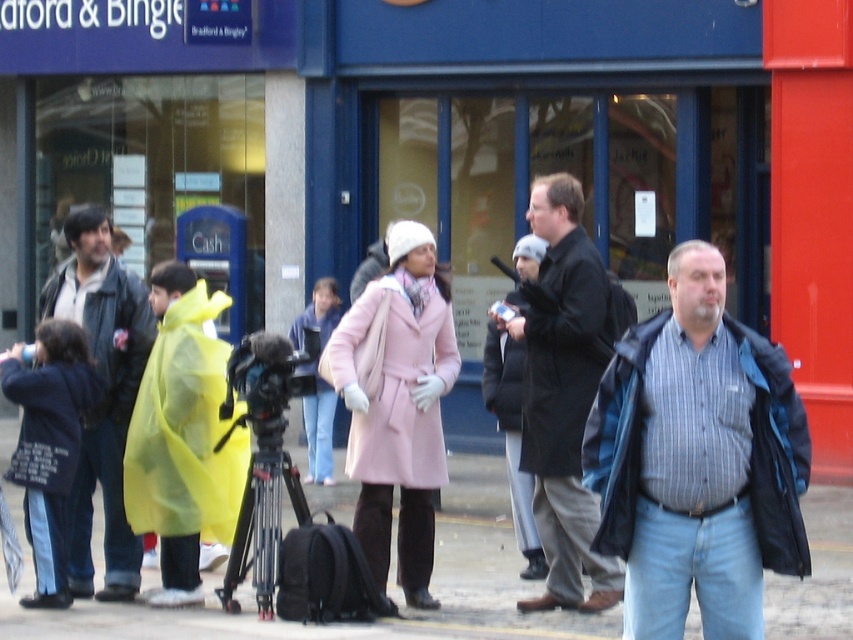
Question: Which point is farther to the camera?

Choices:
 (A) striped cotton shirt at center
 (B) black matte coat at center
 (C) black metal tripod at center
 (D) dark brown leather coat at center

Answer: (D)

Question: Is matte pink coat at center positioned before black matte coat at center?

Choices:
 (A) no
 (B) yes

Answer: (A)

Question: Which point appears farthest from the camera in this image?

Choices:
 (A) (73, 220)
 (B) (115, 356)
 (C) (567, 339)

Answer: (B)

Question: Which point appears closest to the camera in this image?

Choices:
 (A) (16, 464)
 (B) (239, 561)

Answer: (B)

Question: Can you confirm if yellow waterproof coat at left is thinner than dark gray jacket at left?

Choices:
 (A) no
 (B) yes

Answer: (B)

Question: Can you confirm if dark gray jacket at left is wider than matte pink coat at center?

Choices:
 (A) yes
 (B) no

Answer: (B)